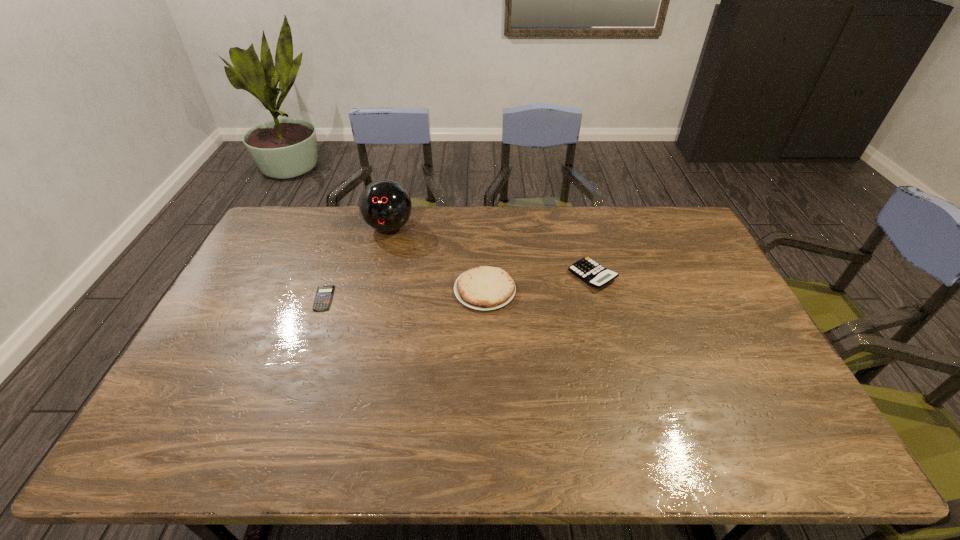
In order to click on vacant space located 0.370m on the right of the shortest object in this screenshot , I will do `click(453, 299)`.

At what (x,y) coordinates should I click in order to perform the action: click on object that is at the far edge. Please return your answer as a coordinate pair (x, y). Looking at the image, I should click on (384, 205).

The image size is (960, 540). What are the coordinates of `vacant space at the far edge` in the screenshot? It's located at (566, 209).

The image size is (960, 540). I want to click on free space at the near edge of the desktop, so click(x=559, y=435).

This screenshot has width=960, height=540. In the image, there is a desktop. In order to click on vacant area at the left edge in this screenshot , I will do `click(234, 310)`.

In the image, there is a desktop. Where is `vacant space at the right edge`? Image resolution: width=960 pixels, height=540 pixels. vacant space at the right edge is located at coordinates (747, 403).

The width and height of the screenshot is (960, 540). I want to click on vacant space at the far left corner of the desktop, so click(310, 213).

Image resolution: width=960 pixels, height=540 pixels. What are the coordinates of `vacant region at the far right corner of the desktop` in the screenshot? It's located at (656, 212).

The image size is (960, 540). I want to click on free space between the second object from right to left and the shorter calculator, so click(x=404, y=294).

Where is `free space between the tortilla and the tallest object`? The width and height of the screenshot is (960, 540). free space between the tortilla and the tallest object is located at coordinates (437, 259).